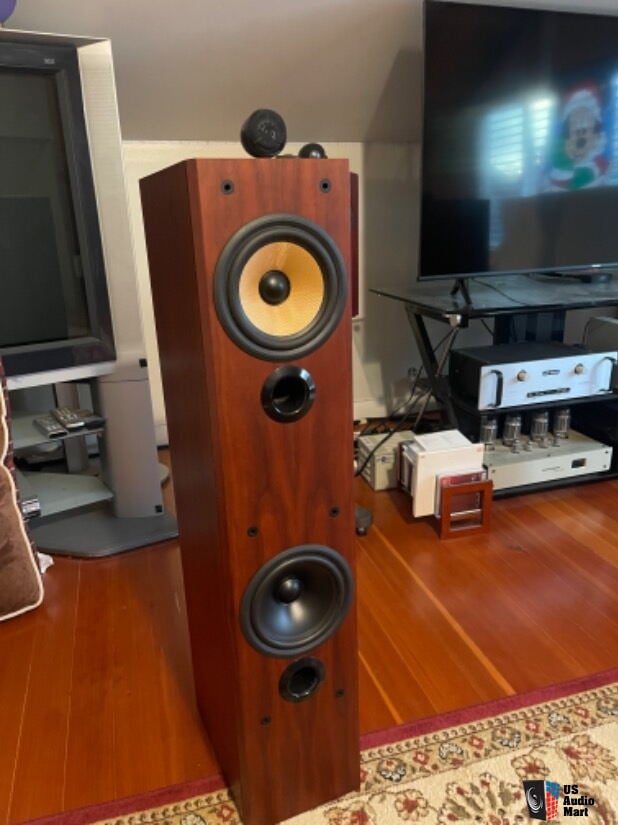
Locate an element on the screen. This screenshot has width=618, height=825. tv is located at coordinates (485, 158), (59, 205).